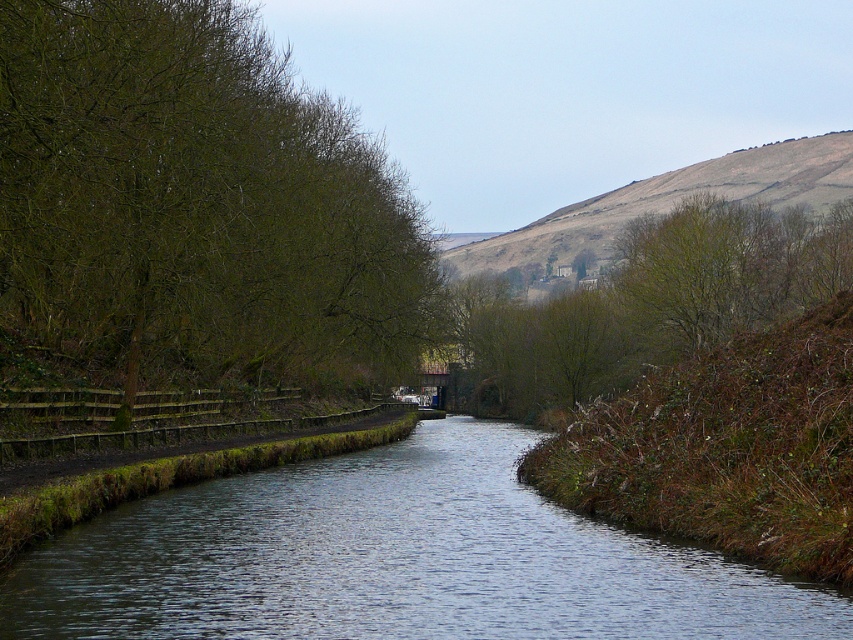
Question: Does smooth concrete canal at center have a greater width compared to green leafy tree at upper center?

Choices:
 (A) yes
 (B) no

Answer: (B)

Question: Which point is closer to the camera?

Choices:
 (A) green leafy tree at upper center
 (B) green leafy tree at left

Answer: (B)

Question: Is green leafy tree at left closer to the viewer compared to smooth concrete canal at center?

Choices:
 (A) no
 (B) yes

Answer: (A)

Question: Among these objects, which one is nearest to the camera?

Choices:
 (A) green leafy tree at upper center
 (B) green leafy tree at left
 (C) smooth concrete canal at center

Answer: (C)

Question: Is green leafy tree at left smaller than green leafy tree at upper center?

Choices:
 (A) yes
 (B) no

Answer: (A)

Question: Which point is farther to the camera?

Choices:
 (A) (206, 20)
 (B) (734, 150)
 (C) (566, 541)

Answer: (B)